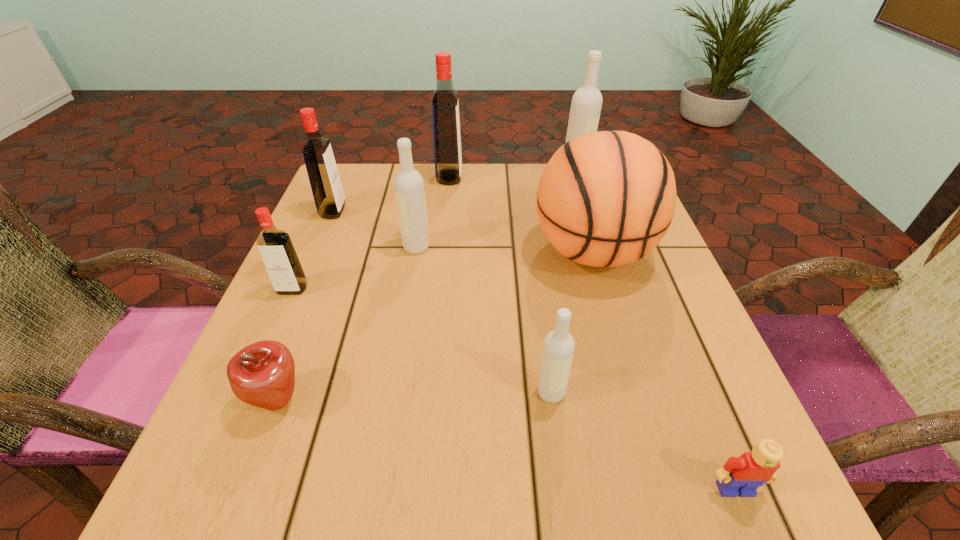
Locate an element on the screen. The height and width of the screenshot is (540, 960). the nearest red vodka is located at coordinates (280, 259).

The width and height of the screenshot is (960, 540). What are the coordinates of `the smallest white vodka` in the screenshot? It's located at (558, 348).

This screenshot has width=960, height=540. In order to click on the nearest white vodka in this screenshot , I will do `click(558, 348)`.

This screenshot has width=960, height=540. Find the location of `apple`. apple is located at coordinates (262, 374).

The image size is (960, 540). I want to click on the nearest object, so click(x=742, y=475).

At what (x,y) coordinates should I click in order to perform the action: click on free spot located on the front and back of the rightmost red vodka. Please return your answer as a coordinate pair (x, y). The width and height of the screenshot is (960, 540). Looking at the image, I should click on (513, 177).

Find the location of `free space located on the front of the rightmost vodka`. free space located on the front of the rightmost vodka is located at coordinates (584, 204).

Locate an element on the screen. free space located 0.260m on the left of the orange basketball is located at coordinates (407, 252).

The width and height of the screenshot is (960, 540). I want to click on vacant space situated 0.290m on the front and back of the second nearest red vodka, so click(x=468, y=211).

Find the location of a particular element. Image resolution: width=960 pixels, height=540 pixels. vacant space located on the right of the leftmost white vodka is located at coordinates (581, 247).